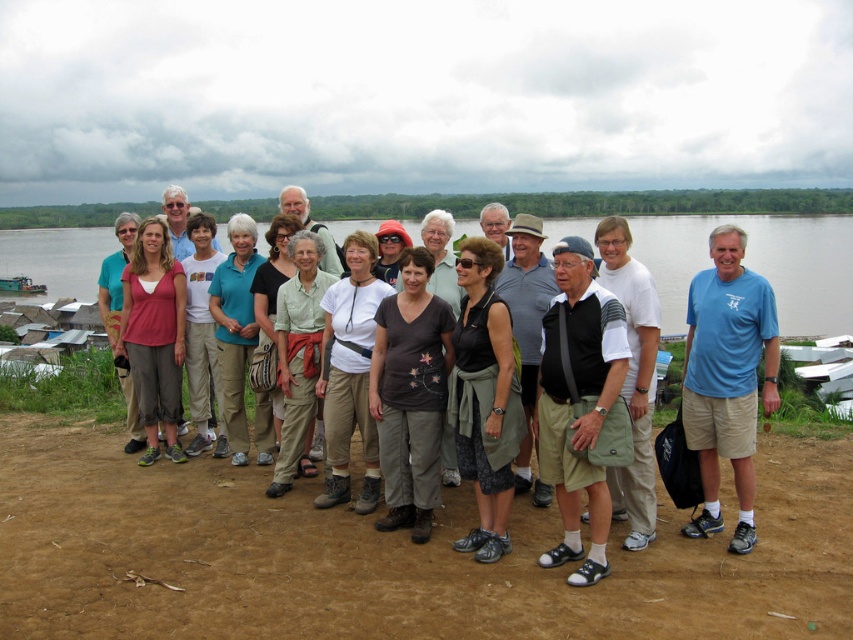
Question: Is brown fabric pants at center to the right of matte pink shirt at center from the viewer's perspective?

Choices:
 (A) no
 (B) yes

Answer: (B)

Question: Which of the following is the farthest from the observer?

Choices:
 (A) brown fabric pants at center
 (B) matte black shirt at center
 (C) matte pink shirt at center
 (D) dark gray fabric dress at center

Answer: (C)

Question: Can you confirm if brown dirt field at lower center is positioned to the right of matte khaki shorts at center?

Choices:
 (A) no
 (B) yes

Answer: (A)

Question: Estimate the real-world distances between objects in this image. Which object is closer to the white cotton shirt at center?

Choices:
 (A) matte khaki shorts at center
 (B) matte black shirt at center
 (C) blue t-shirt at center

Answer: (B)

Question: Among these objects, which one is farthest from the camera?

Choices:
 (A) dark gray fabric dress at center
 (B) white cotton shirt at center
 (C) khaki cotton shorts at center

Answer: (B)

Question: Is brown dirt field at lower center above matte black shirt at center?

Choices:
 (A) yes
 (B) no

Answer: (B)